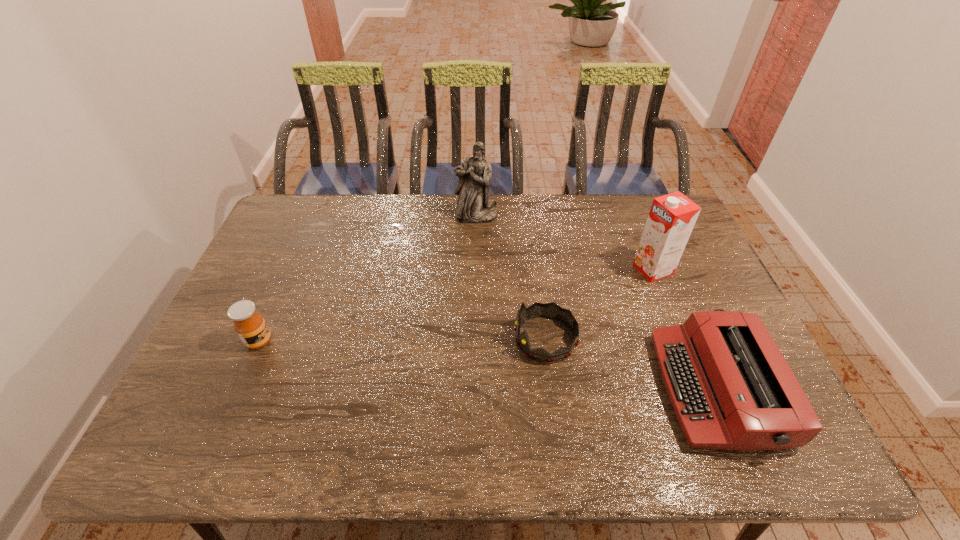
You are a GUI agent. You are given a task and a screenshot of the screen. Output one action in this format:
    pyautogui.click(x=<x>, y=<y>)
    Task: Click on the vacant space situated at the front of the third object from right to left with jewels
    This screenshot has width=960, height=540.
    Given the screenshot: What is the action you would take?
    pyautogui.click(x=383, y=339)

Locate an element on the screen. The width and height of the screenshot is (960, 540). vacant area situated at the front of the third object from right to left with jewels is located at coordinates [391, 339].

What are the coordinates of `vacant point located 0.150m on the typing side of the typewriter` in the screenshot? It's located at (601, 388).

This screenshot has width=960, height=540. Find the location of `vacant space situated 0.220m on the typing side of the typewriter`. vacant space situated 0.220m on the typing side of the typewriter is located at coordinates (572, 388).

Locate an element on the screen. This screenshot has width=960, height=540. free location located on the typing side of the typewriter is located at coordinates (556, 388).

Image resolution: width=960 pixels, height=540 pixels. Find the location of `object present at the far edge`. object present at the far edge is located at coordinates (474, 206).

Where is `object situated at the near edge`? The image size is (960, 540). object situated at the near edge is located at coordinates 731,388.

Identify the location of object that is at the left edge. (250, 326).

Identify the location of carton at the right edge. (671, 219).

Locate an element on the screen. typewriter located in the right edge section of the desktop is located at coordinates (731, 388).